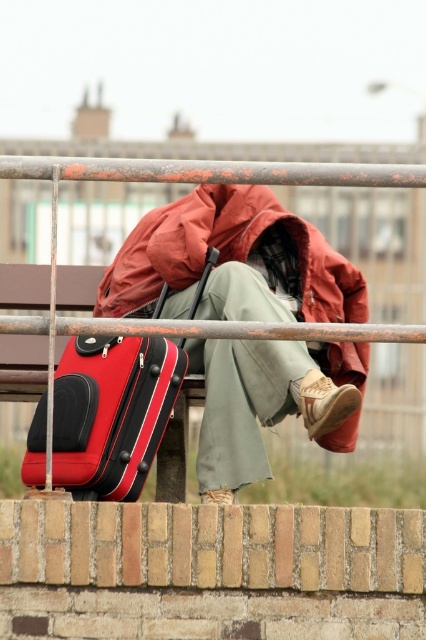
Between point (278, 253) and point (160, 348), which one is positioned behind?

Positioned behind is point (278, 253).

The image size is (426, 640). Describe the element at coordinates (230, 262) in the screenshot. I see `matte red jacket at center` at that location.

Who is more forward, (288,392) or (28,476)?

Point (28,476) is more forward.

Find the location of a particular element. This screenshot has height=640, width=426. matte red jacket at center is located at coordinates tap(230, 262).